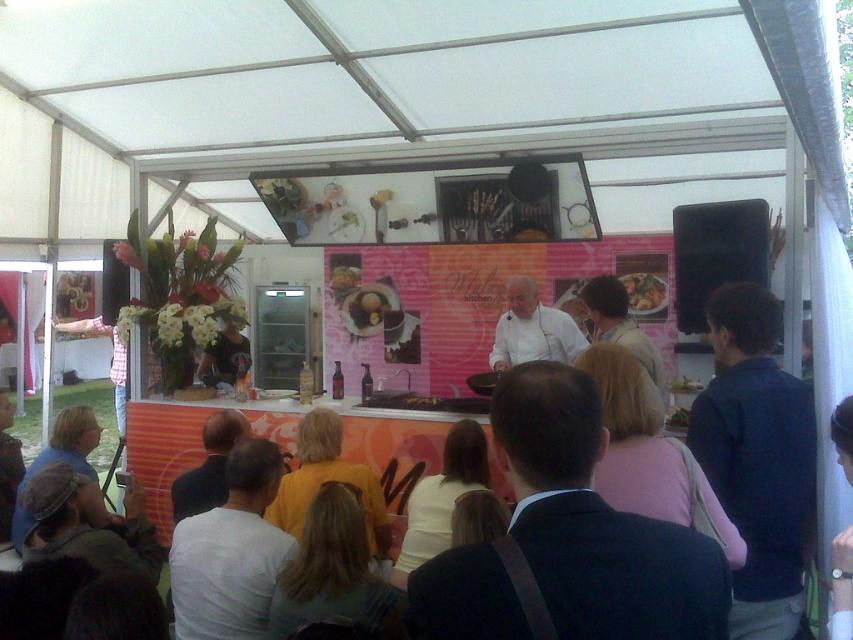
Does white chef coat at center appear under shiny golden plate at center?

Yes, white chef coat at center is below shiny golden plate at center.

Is point (491, 365) farther from viewer compared to point (643, 308)?

No, it is in front of (643, 308).

Is point (500, 362) farther from viewer compared to point (639, 300)?

No, it is not.

Identify the location of white chef coat at center. (532, 330).